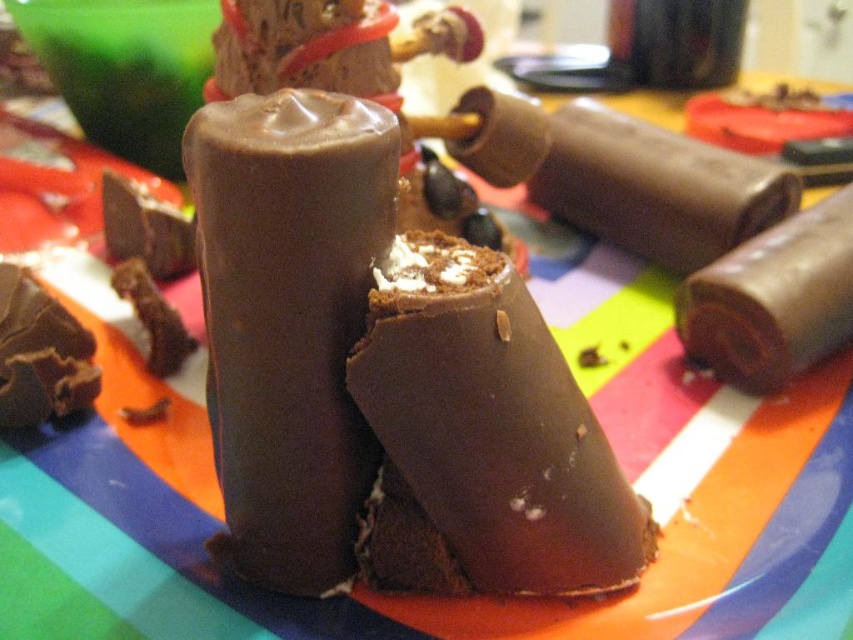
From the picture: You are a dessert chef trying to arrange two chocolate items on a plate. You have a chocolatesmoothcandy at center and a chocolate matte at upper right. Based on their sizes, which one should you place closer to the edge of the plate to ensure both fit comfortably?

The chocolatesmoothcandy at center has a smaller width than the chocolate matte at upper right, so you should place the chocolatesmoothcandy at center closer to the edge to accommodate both items comfortably.

From the picture: You are a dessert artist arranging two chocolate ice cream bars on a striped plate. You have the chocolatesmoothcandy at center and the chocolate matte at right. Which one should you place closer to the edge of the plate to ensure both fit without overlapping?

The chocolate matte at right is smaller than the chocolatesmoothcandy at center, so placing the chocolate matte at right closer to the edge will allow both to fit without overlapping.

You are looking at the chocolate ice cream bars on the plate. There are two points marked on the image. One is at coordinate point [271,225] and the other is at point [753,216]. Which point is closer to you?

Point [271,225] is closer to the viewer than point [753,216].